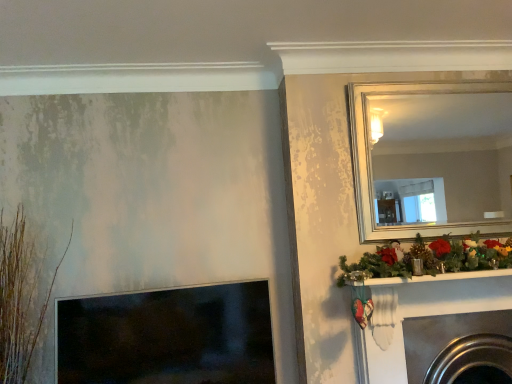
What do you see at coordinates (445, 335) in the screenshot? I see `metallic silver fireplace at lower right` at bounding box center [445, 335].

Identify the location of metallic silver fireplace at lower right. tap(445, 335).

This screenshot has height=384, width=512. Find the location of `metallic silver fireplace at lower right`. metallic silver fireplace at lower right is located at coordinates (445, 335).